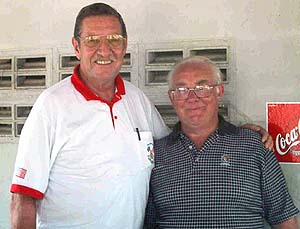
Find the location of a particular element. The width and height of the screenshot is (300, 229). wall is located at coordinates (260, 65).